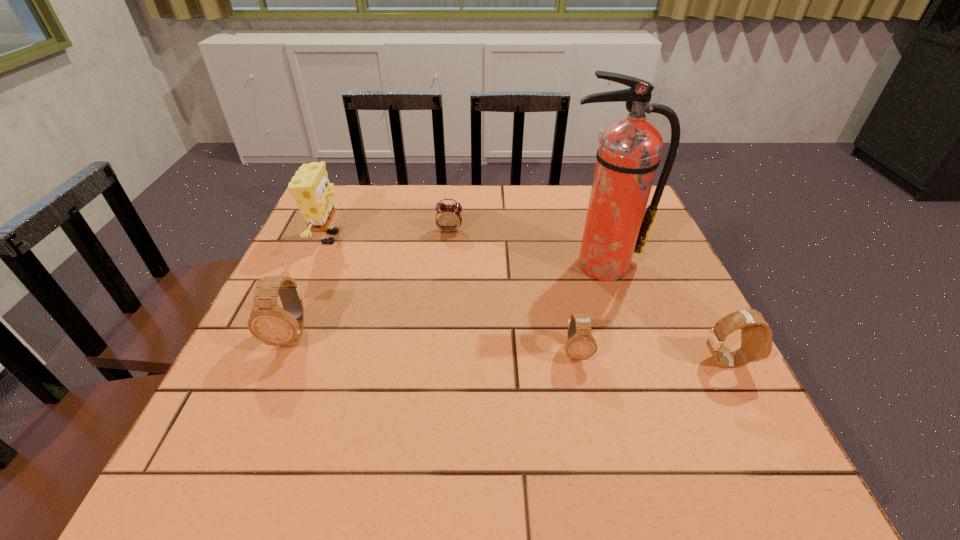
Locate an element on the screen. This screenshot has height=540, width=960. blank area located 0.390m on the face of the second tallest object is located at coordinates (496, 238).

Locate an element on the screen. The image size is (960, 540). free point located at the nozzle of the tallest object is located at coordinates (641, 393).

Locate an element on the screen. This screenshot has width=960, height=540. free space located on the face of the third object from left to right is located at coordinates click(x=444, y=285).

I want to click on sponge located in the far edge section of the desktop, so click(x=310, y=187).

This screenshot has height=540, width=960. What are the coordinates of `alarm clock that is at the far edge` in the screenshot? It's located at (448, 218).

This screenshot has height=540, width=960. In order to click on watch that is at the left edge in this screenshot , I will do `click(268, 322)`.

Where is `sponge that is at the left edge`? sponge that is at the left edge is located at coordinates (310, 187).

I want to click on watch that is at the right edge, so click(x=756, y=336).

Locate an element on the screen. fire extinguisher at the right edge is located at coordinates (617, 225).

Identify the location of object that is at the far left corner. (310, 187).